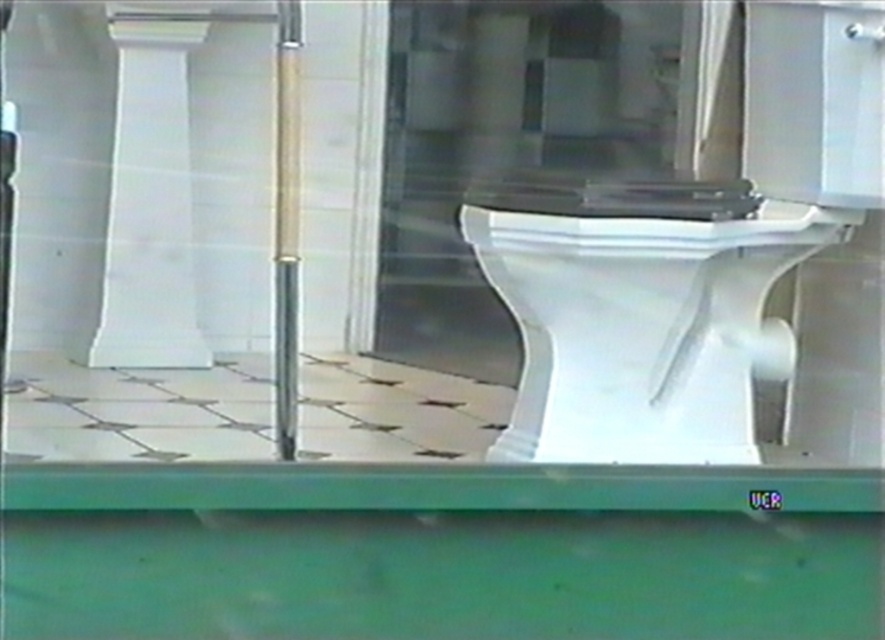
Question: Estimate the real-world distances between objects in this image. Which object is farther from the transparent glass door at center?

Choices:
 (A) white glossy toilet bowl at center
 (B) white glossy pillar at upper left

Answer: (A)

Question: Does transparent glass door at center have a smaller size compared to white glossy pillar at upper left?

Choices:
 (A) yes
 (B) no

Answer: (B)

Question: Estimate the real-world distances between objects in this image. Which object is farther from the transparent glass door at center?

Choices:
 (A) white glossy pillar at upper left
 (B) white glossy toilet bowl at center

Answer: (B)

Question: Is white glossy toilet bowl at center to the right of transparent glass door at center from the viewer's perspective?

Choices:
 (A) yes
 (B) no

Answer: (A)

Question: Among these points, which one is nearest to the camera?

Choices:
 (A) (774, 252)
 (B) (396, 88)
 (C) (113, 157)

Answer: (A)

Question: Does white glossy toilet bowl at center appear on the right side of transparent glass door at center?

Choices:
 (A) no
 (B) yes

Answer: (B)